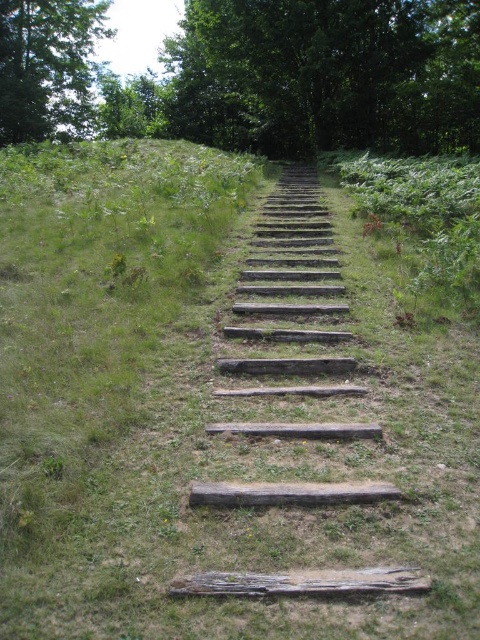
Question: Does green leafy tree at upper center appear over weathered wood stairs at center?

Choices:
 (A) no
 (B) yes

Answer: (B)

Question: Which is nearer to the green leafy tree at upper center?

Choices:
 (A) green leafy tree at upper left
 (B) weathered wood stairs at center

Answer: (A)

Question: Is green leafy tree at upper center further to camera compared to green leafy tree at upper left?

Choices:
 (A) yes
 (B) no

Answer: (B)

Question: Estimate the real-world distances between objects in this image. Which object is closer to the weathered wood stairs at center?

Choices:
 (A) green leafy tree at upper left
 (B) green leafy tree at upper center

Answer: (B)

Question: Does green leafy tree at upper center have a smaller size compared to green leafy tree at upper left?

Choices:
 (A) yes
 (B) no

Answer: (B)

Question: Which object appears farthest from the camera in this image?

Choices:
 (A) green leafy tree at upper left
 (B) weathered wood stairs at center

Answer: (A)